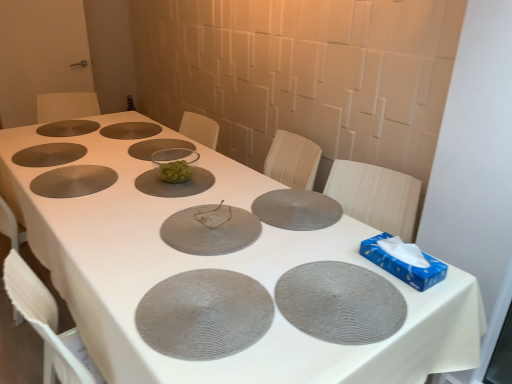
What are the coordinates of `vacant space to the left of matte brown glass plate at center, which appears as the ninth glass plate when viewed from the front` in the screenshot? It's located at (74, 126).